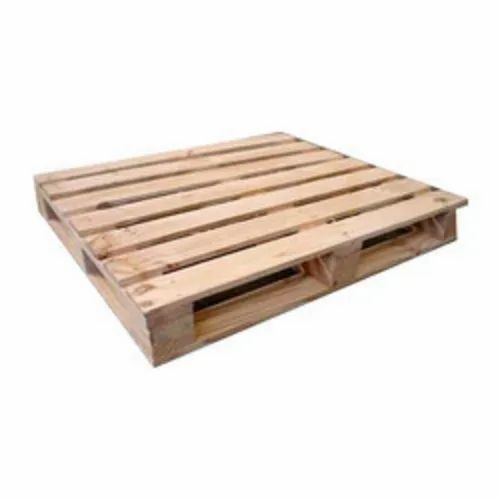
You are a GUI agent. You are given a task and a screenshot of the screen. Output one action in this format:
    pyautogui.click(x=<x>, y=<y>)
    Task: Click on the square wooden object
    The image size is (500, 500).
    Given the screenshot: What is the action you would take?
    pyautogui.click(x=238, y=198)